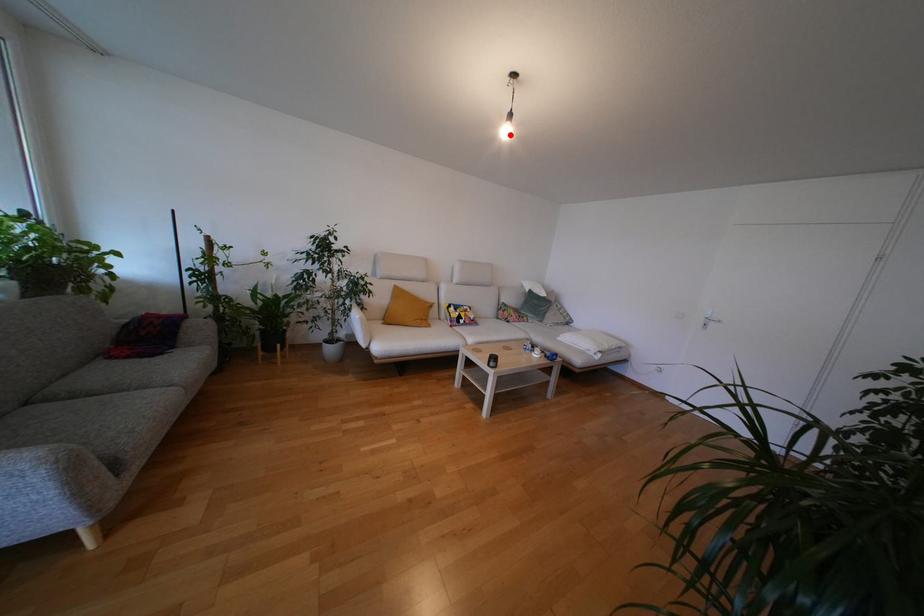
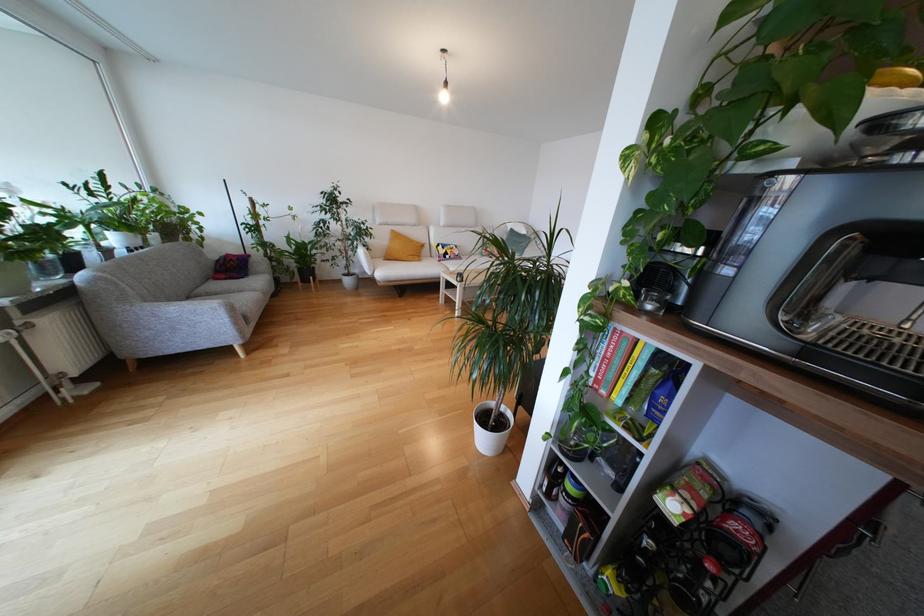
In the second image, find the point that corresponds to the highlighted location in the first image.

(448, 100)